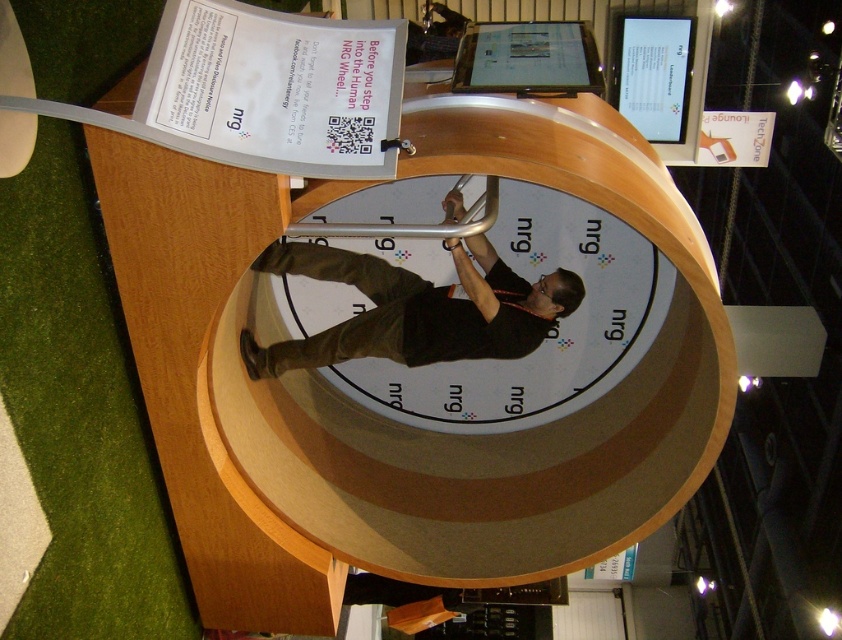
Can you confirm if dark brown leather pants at center is taller than matte black monitor at upper center?

Yes, dark brown leather pants at center is taller than matte black monitor at upper center.

Who is positioned more to the left, dark brown leather pants at center or matte black monitor at upper center?

dark brown leather pants at center

Is point (462, 269) closer to viewer compared to point (579, 74)?

No, (462, 269) is further to viewer.

Image resolution: width=842 pixels, height=640 pixels. I want to click on dark brown leather pants at center, so click(414, 308).